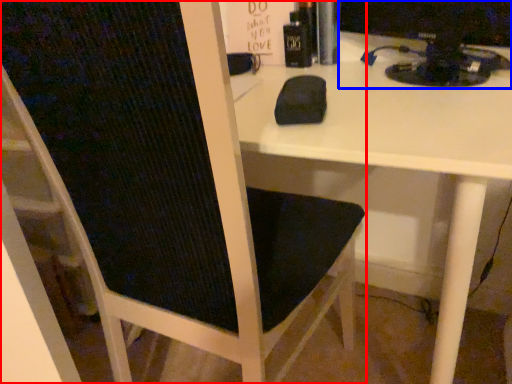
Question: Which object is further to the camera taking this photo, chair (highlighted by a red box) or desktop computer (highlighted by a blue box)?

Choices:
 (A) chair
 (B) desktop computer

Answer: (B)